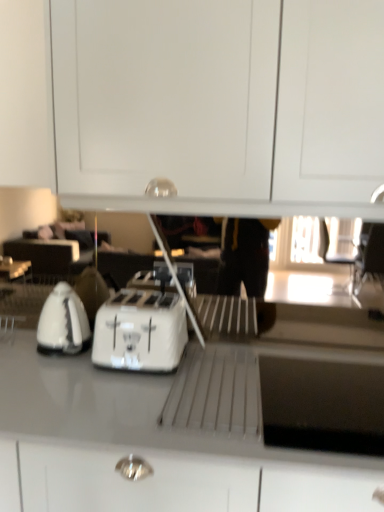
This screenshot has height=512, width=384. What do you see at coordinates (63, 322) in the screenshot?
I see `white glossy kettle at left` at bounding box center [63, 322].

Find the location of a particular element. white glossy countertop at center is located at coordinates (149, 443).

Locate an element on the screen. white glossy cabinet at upper center is located at coordinates (217, 105).

Between white glossy kettle at left and white glossy countertop at center, which one has smaller width?

With smaller width is white glossy kettle at left.

Can you confirm if white glossy kettle at left is bigger than white glossy countertop at center?

No, white glossy kettle at left is not bigger than white glossy countertop at center.

From a real-world perspective, is white glossy kettle at left above or below white glossy countertop at center?

From a real-world perspective, white glossy kettle at left is physically above white glossy countertop at center.

Based on their positions, is white glossy kettle at left located to the left or right of white glossy countertop at center?

Based on their positions, white glossy kettle at left is located to the left of white glossy countertop at center.

At what (x,y) coordinates should I click in order to perform the action: click on kitchen appliance above the white glossy countertop at center (from a real-world perspective). Please return your answer as a coordinate pair (x, y). This screenshot has width=384, height=512. Looking at the image, I should click on (140, 331).

Can you confirm if white plastic toaster at center is thinner than white glossy countertop at center?

Indeed, white plastic toaster at center has a lesser width compared to white glossy countertop at center.

From the image's perspective, between white plastic toaster at center and white glossy countertop at center, who is located below?

white glossy countertop at center is shown below in the image.

How distant is white glossy kettle at left from white plastic toaster at center?

The distance of white glossy kettle at left from white plastic toaster at center is 7.52 inches.

Is white glossy kettle at left looking in the opposite direction of white plastic toaster at center?

white glossy kettle at left is not turned away from white plastic toaster at center.

Is point (52, 297) closer to camera compared to point (164, 320)?

No, (52, 297) is further to viewer.

Is white glossy kettle at left to the left or to the right of white plastic toaster at center in the image?

In the image, white glossy kettle at left appears on the left side of white plastic toaster at center.

Image resolution: width=384 pixels, height=512 pixels. I want to click on home appliance on the left of white glossy countertop at center, so click(x=63, y=322).

Does point (16, 419) come closer to viewer compared to point (41, 323)?

That is True.

Between white glossy countertop at center and white glossy kettle at left, which one appears on the right side from the viewer's perspective?

white glossy countertop at center is more to the right.

In terms of height, does white glossy countertop at center look taller or shorter compared to white glossy kettle at left?

Clearly, white glossy countertop at center is taller compared to white glossy kettle at left.

In the image, is white glossy countertop at center positioned in front of or behind white plastic toaster at center?

white glossy countertop at center is in front of white plastic toaster at center.

From the image's perspective, which one is positioned higher, white glossy countertop at center or white plastic toaster at center?

white plastic toaster at center appears higher in the image.

Is white glossy countertop at center completely or partially outside of white plastic toaster at center?

white glossy countertop at center lies outside white plastic toaster at center's area.

How much distance is there between white glossy cabinet at upper center and white glossy kettle at left?

The distance of white glossy cabinet at upper center from white glossy kettle at left is 27.80 inches.

Does white glossy cabinet at upper center come behind white glossy kettle at left?

No.

Considering the relative sizes of white glossy cabinet at upper center and white glossy kettle at left in the image provided, is white glossy cabinet at upper center wider than white glossy kettle at left?

Correct, the width of white glossy cabinet at upper center exceeds that of white glossy kettle at left.

Could you tell me if white glossy cabinet at upper center is turned towards white glossy kettle at left?

No, white glossy cabinet at upper center does not turn towards white glossy kettle at left.

How distant is white plastic toaster at center from white glossy cabinet at upper center?

white plastic toaster at center is 55.91 centimeters from white glossy cabinet at upper center.

In terms of height, does white plastic toaster at center look taller or shorter compared to white glossy cabinet at upper center?

Considering their sizes, white plastic toaster at center has less height than white glossy cabinet at upper center.

From the image's perspective, does white plastic toaster at center appear lower than white glossy cabinet at upper center?

Yes, from the image's perspective, white plastic toaster at center is beneath white glossy cabinet at upper center.

Based on the photo, does white plastic toaster at center have a smaller size compared to white glossy cabinet at upper center?

Indeed, white plastic toaster at center has a smaller size compared to white glossy cabinet at upper center.

At what (x,y) coordinates should I click in order to perform the action: click on countertop lying on the right of white glossy kettle at left. Please return your answer as a coordinate pair (x, y). Looking at the image, I should click on (149, 443).

Locate an element on the screen. This screenshot has width=384, height=512. kitchen appliance above the white glossy countertop at center (from the image's perspective) is located at coordinates (140, 331).

Which object lies further to the anchor point white glossy kettle at left, white glossy cabinet at upper center or white glossy countertop at center?

The object further to white glossy kettle at left is white glossy cabinet at upper center.

Based on the photo, which object lies nearer to the anchor point white glossy cabinet at upper center, white glossy countertop at center or white glossy kettle at left?

Among the two, white glossy countertop at center is located nearer to white glossy cabinet at upper center.

Estimate the real-world distances between objects in this image. Which object is further from white plastic toaster at center, white glossy kettle at left or white glossy cabinet at upper center?

The object further to white plastic toaster at center is white glossy cabinet at upper center.

From the image, which object appears to be farther from white glossy countertop at center, white plastic toaster at center or white glossy cabinet at upper center?

Among the two, white glossy cabinet at upper center is located further to white glossy countertop at center.

Based on their spatial positions, is white plastic toaster at center or white glossy countertop at center further from white glossy cabinet at upper center?

white glossy countertop at center is further to white glossy cabinet at upper center.

From the image, which object appears to be nearer to white glossy cabinet at upper center, white glossy kettle at left or white glossy countertop at center?

The object closer to white glossy cabinet at upper center is white glossy countertop at center.

Based on their spatial positions, is white glossy cabinet at upper center or white glossy countertop at center further from white plastic toaster at center?

The object further to white plastic toaster at center is white glossy cabinet at upper center.

From the image, which object appears to be nearer to white glossy cabinet at upper center, white plastic toaster at center or white glossy kettle at left?

white plastic toaster at center is closer to white glossy cabinet at upper center.

This screenshot has width=384, height=512. Identify the location of home appliance between white glossy cabinet at upper center and white plastic toaster at center vertically. 63,322.

Where is `kitchen appliance between white glossy kettle at left and white glossy countertop at center from top to bottom`? This screenshot has width=384, height=512. kitchen appliance between white glossy kettle at left and white glossy countertop at center from top to bottom is located at coordinates (140, 331).

You are a GUI agent. You are given a task and a screenshot of the screen. Output one action in this format:
    pyautogui.click(x=<x>, y=<y>)
    Task: Click on the home appliance between white glossy cabinet at upper center and white glossy countertop at center vertically
    The image size is (384, 512).
    Given the screenshot: What is the action you would take?
    pyautogui.click(x=63, y=322)

Locate an element on the screen. This screenshot has height=512, width=384. kitchen appliance that lies between white glossy cabinet at upper center and white glossy countertop at center from top to bottom is located at coordinates (140, 331).